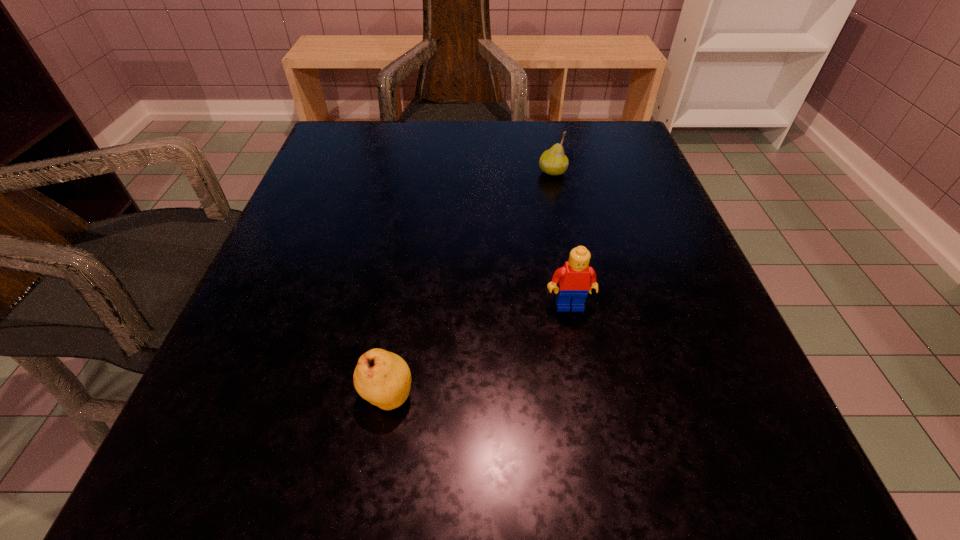
Locate an element on the screen. The height and width of the screenshot is (540, 960). empty space between the right pear and the nearest object is located at coordinates (469, 284).

The height and width of the screenshot is (540, 960). I want to click on vacant point located between the tallest object and the nearest object, so click(x=478, y=350).

The image size is (960, 540). In order to click on free space between the leftmost object and the right pear in this screenshot , I will do [x=469, y=284].

This screenshot has height=540, width=960. I want to click on vacant space that's between the nearest object and the tallest object, so click(478, 350).

You are a GUI agent. You are given a task and a screenshot of the screen. Output one action in this format:
    pyautogui.click(x=<x>, y=<y>)
    Task: Click on the free point between the nearest object and the farthest object
    
    Given the screenshot: What is the action you would take?
    pyautogui.click(x=469, y=284)

Identify which object is the nearest to the second farthest object. Please provide its 2D coordinates. Your answer should be formatted as a tuple, i.e. [(x, y)], where the tuple contains the x and y coordinates of a point satisfying the conditions above.

[(383, 378)]

Select which object appears as the closest to the farther pear. Please provide its 2D coordinates. Your answer should be formatted as a tuple, i.e. [(x, y)], where the tuple contains the x and y coordinates of a point satisfying the conditions above.

[(575, 278)]